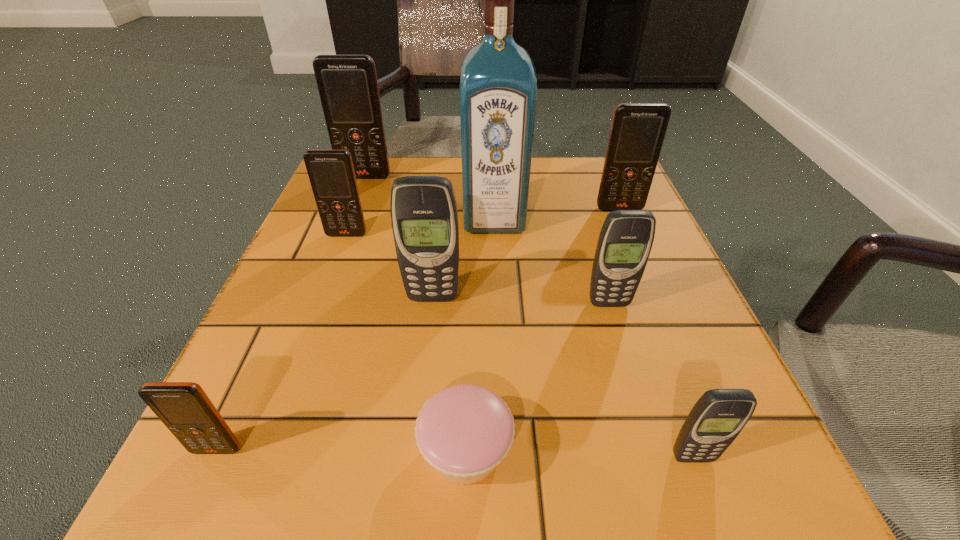
Where is `free region located 0.150m on the screen of the third farthest orange cellular telephone`? free region located 0.150m on the screen of the third farthest orange cellular telephone is located at coordinates (325, 291).

What are the coordinates of `vacant space located on the screen of the nearest gray cellular telephone` in the screenshot? It's located at (714, 516).

The width and height of the screenshot is (960, 540). I want to click on vacant space located on the back of the cupcake, so click(x=468, y=366).

The image size is (960, 540). Identify the location of liquor that is at the far edge. (498, 85).

The image size is (960, 540). I want to click on cupcake at the near edge, so click(464, 431).

Find the location of a particular element. object that is at the far left corner is located at coordinates [347, 84].

Find the location of a particular element. object that is at the near left corner is located at coordinates (184, 408).

The height and width of the screenshot is (540, 960). I want to click on object at the far right corner, so click(638, 130).

Where is `object that is positioned at the near right corner`? The height and width of the screenshot is (540, 960). object that is positioned at the near right corner is located at coordinates (717, 418).

You are a GUI agent. You are given a task and a screenshot of the screen. Output one action in this format:
    pyautogui.click(x=<x>, y=<y>)
    Task: Click on the free space at the near edge of the desktop
    This screenshot has height=540, width=960.
    Given the screenshot: What is the action you would take?
    pyautogui.click(x=387, y=506)